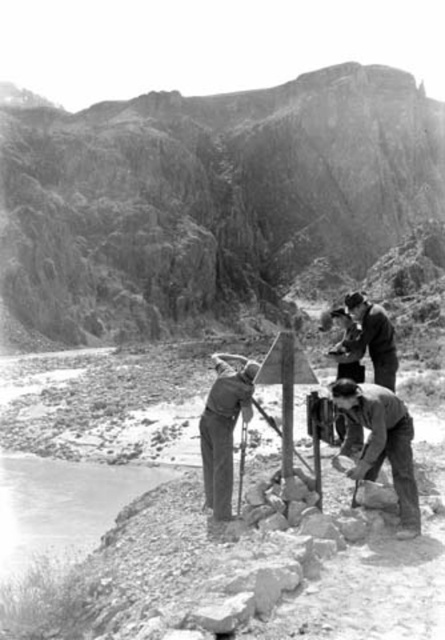
Can you confirm if smooth rock river at lower left is shorter than metallic signpost at center?

Yes, smooth rock river at lower left is shorter than metallic signpost at center.

Between smooth rock river at lower left and metallic signpost at center, which one has more height?

metallic signpost at center

Is point (12, 561) less distant than point (238, 500)?

No.

Identify the location of smooth rock river at lower left. Image resolution: width=445 pixels, height=640 pixels. (56, 529).

Can you confirm if smooth rock river at lower left is shorter than smooth gray pants at center?

Yes, smooth rock river at lower left is shorter than smooth gray pants at center.

Is smooth rock river at lower left further to camera compared to smooth gray pants at center?

No, it is in front of smooth gray pants at center.

Does point (80, 536) come in front of point (226, 413)?

No, (80, 536) is behind (226, 413).

Find the location of a particular element. smooth rock river at lower left is located at coordinates (56, 529).

Based on the photo, between smooth rock river at lower left and metallic pole at center, which one appears on the right side from the viewer's perspective?

From the viewer's perspective, metallic pole at center appears more on the right side.

Who is taller, smooth rock river at lower left or metallic pole at center?

With more height is metallic pole at center.

Is point (16, 467) less distant than point (287, 385)?

No, (16, 467) is further to viewer.

Locate an element on the screen. The width and height of the screenshot is (445, 640). smooth rock river at lower left is located at coordinates (56, 529).